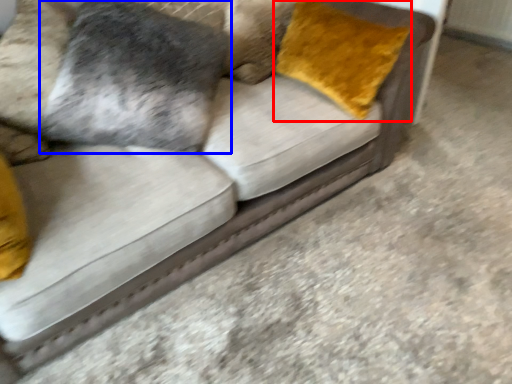
Question: Among these objects, which one is farthest to the camera, throw pillow (highlighted by a red box) or pillow (highlighted by a blue box)?

Choices:
 (A) throw pillow
 (B) pillow

Answer: (B)